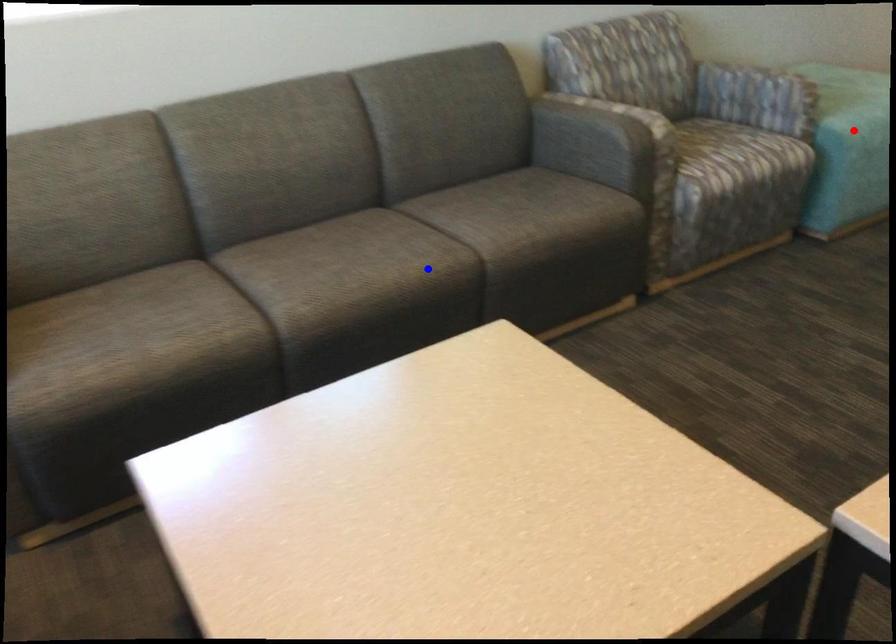
Question: Which of the two points in the image is closer to the camera?

Choices:
 (A) Blue point is closer.
 (B) Red point is closer.

Answer: (A)